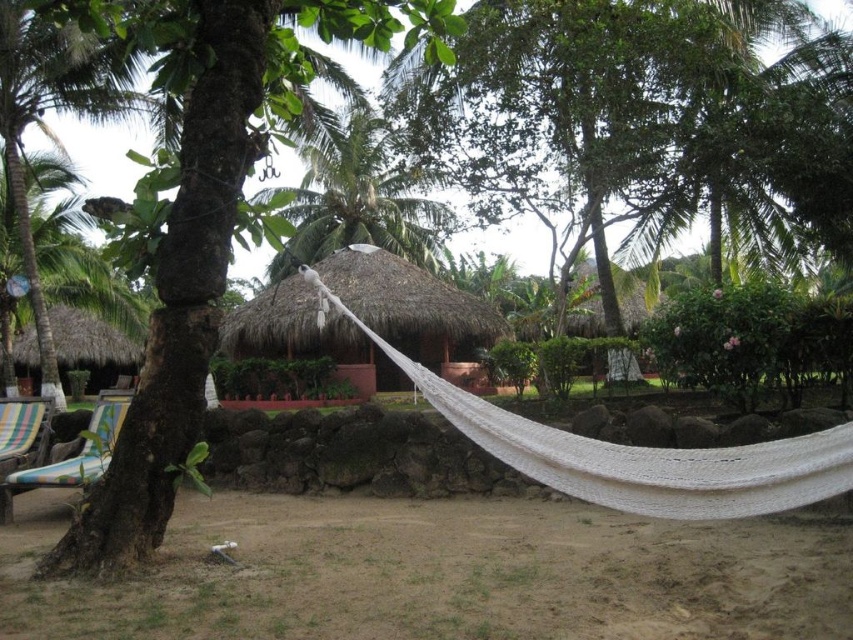
Question: Does striped fabric beach chair at lower left have a smaller size compared to thatched roof hut at upper center?

Choices:
 (A) no
 (B) yes

Answer: (B)

Question: Which of these objects is positioned farthest from the thatched straw hut at left?

Choices:
 (A) striped fabric beach chair at lower left
 (B) green leafy palm tree at left

Answer: (A)

Question: Does multicolored fabric beach chair at lower left lie behind thatched roof hut at upper center?

Choices:
 (A) no
 (B) yes

Answer: (A)

Question: Estimate the real-world distances between objects in this image. Which object is closer to the thatched roof hut at upper center?

Choices:
 (A) green leafy palm tree at upper center
 (B) striped fabric beach chair at lower left

Answer: (A)

Question: Does thatched straw hut at center appear under striped fabric beach chair at lower left?

Choices:
 (A) yes
 (B) no

Answer: (B)

Question: Which of the following is the farthest from the observer?

Choices:
 (A) (18, 116)
 (B) (10, 401)

Answer: (A)